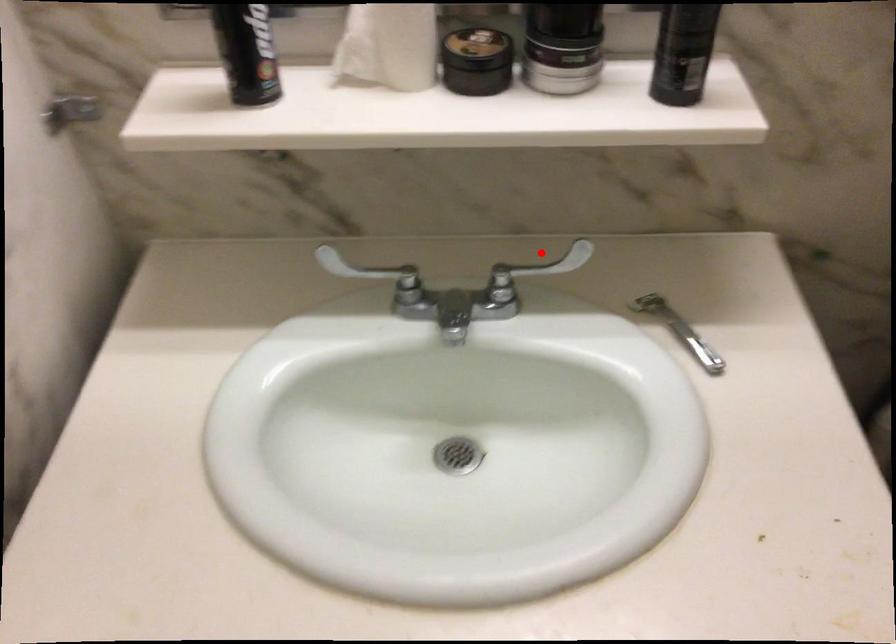
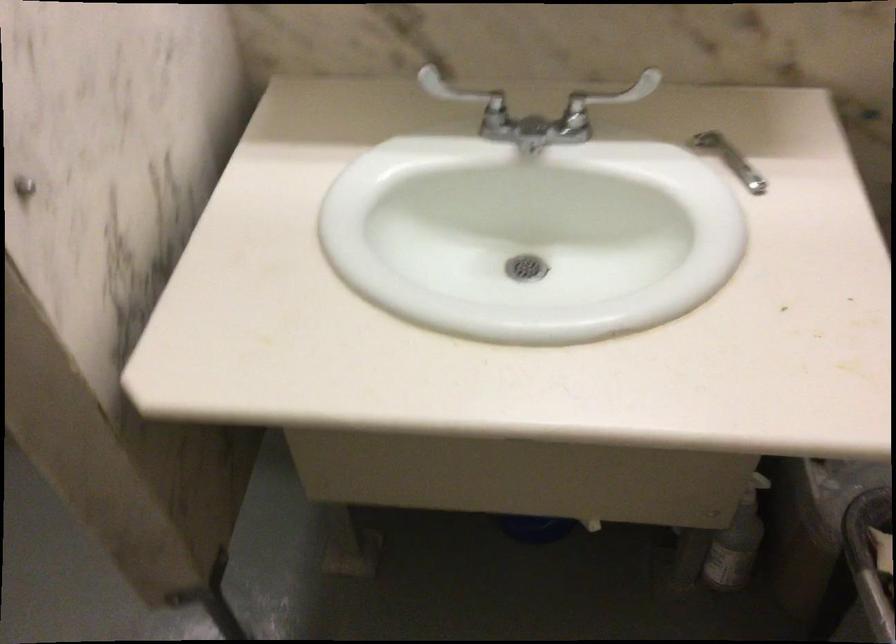
In the second image, find the point that corresponds to the highlighted location in the first image.

(608, 98)